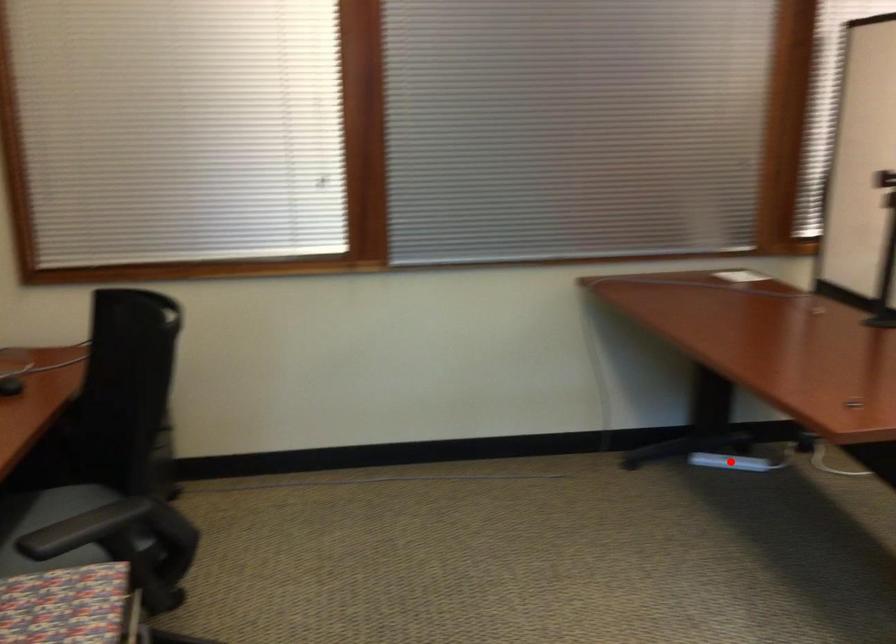
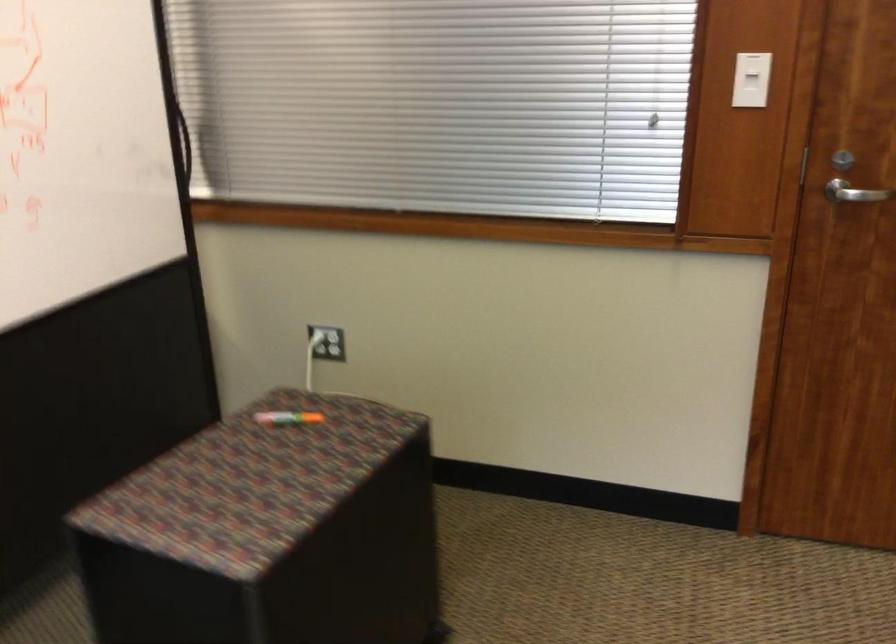
Question: I am providing you with two images of the same scene from different viewpoints. A red point is marked on the first image. At the location where the point appears in image 1, is it still visible in image 2?

Choices:
 (A) Yes
 (B) No

Answer: (B)